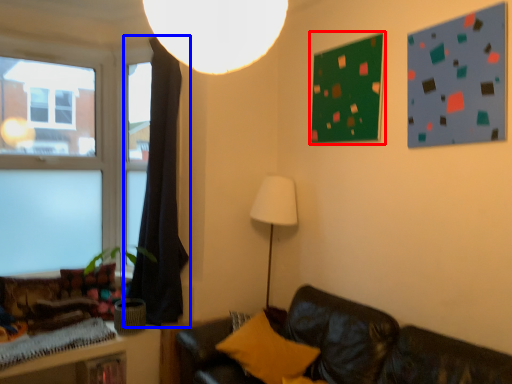
Question: Which of the following is the closest to the observer, bulletin board (highlighted by a red box) or curtain (highlighted by a blue box)?

Choices:
 (A) bulletin board
 (B) curtain

Answer: (A)